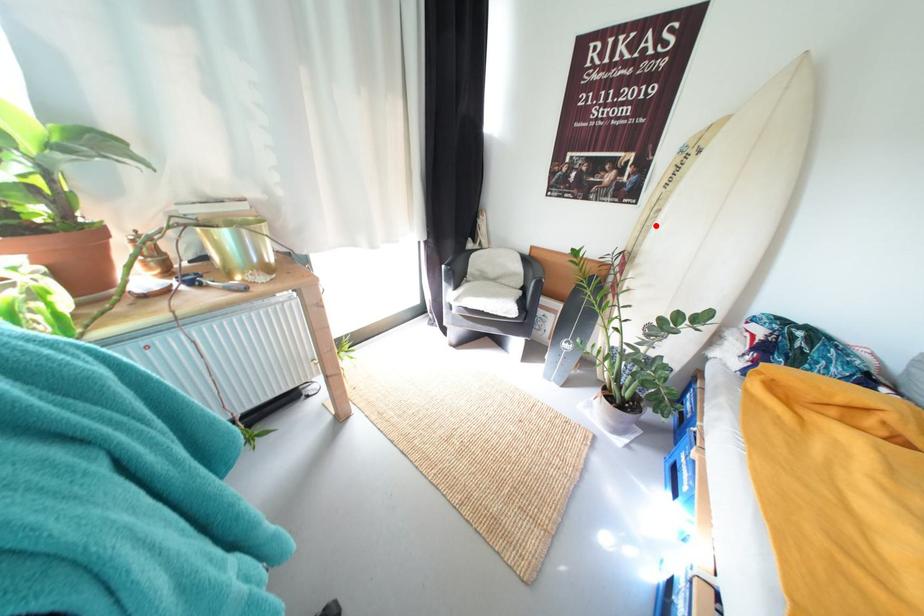
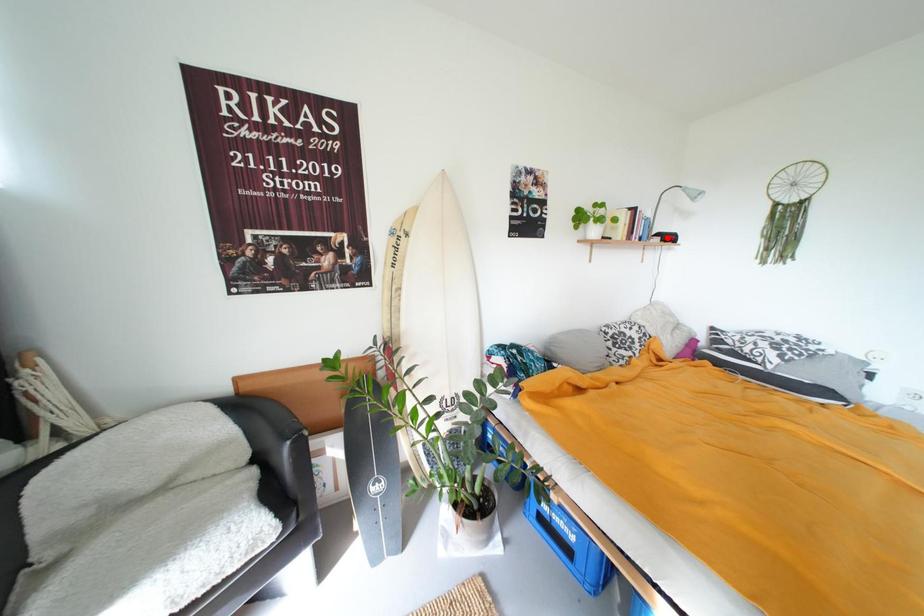
I am providing you with two images of the same scene from different viewpoints. A red point is marked on the first image and another point is marked on the second image. Are the points marked in image1 and image2 representing the same 3D position?

No